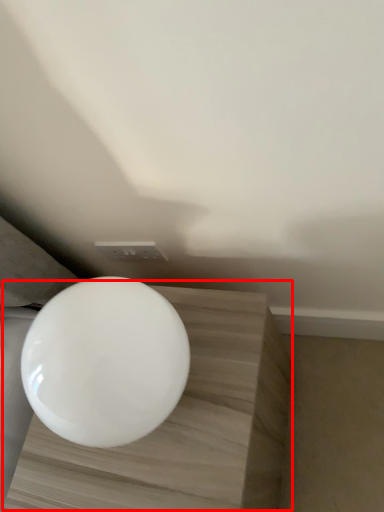
Question: From the image's perspective, where is table (annotated by the red box) located relative to toilet?

Choices:
 (A) below
 (B) above

Answer: (A)